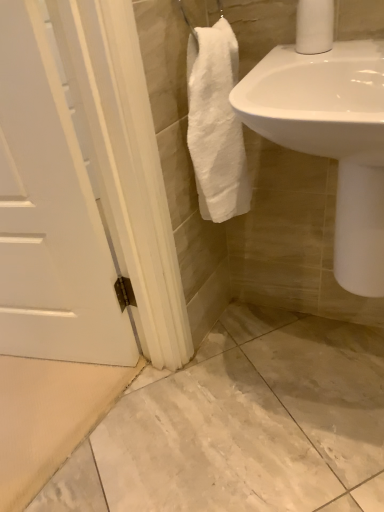
Question: In terms of size, does white matte toilet paper at upper right appear bigger or smaller than white glossy sink at upper right?

Choices:
 (A) big
 (B) small

Answer: (B)

Question: Does point pyautogui.click(x=327, y=28) appear closer or farther from the camera than point pyautogui.click(x=238, y=112)?

Choices:
 (A) closer
 (B) farther

Answer: (B)

Question: Looking at their shapes, would you say white matte toilet paper at upper right is wider or thinner than white glossy sink at upper right?

Choices:
 (A) wide
 (B) thin

Answer: (B)

Question: Is white glossy sink at upper right in front of or behind white matte toilet paper at upper right in the image?

Choices:
 (A) front
 (B) behind

Answer: (A)

Question: Is point (258, 96) closer or farther from the camera than point (332, 13)?

Choices:
 (A) farther
 (B) closer

Answer: (B)

Question: Is white glossy sink at upper right to the left or to the right of white matte toilet paper at upper right in the image?

Choices:
 (A) left
 (B) right

Answer: (B)

Question: In terms of width, does white glossy sink at upper right look wider or thinner when compared to white matte toilet paper at upper right?

Choices:
 (A) wide
 (B) thin

Answer: (A)